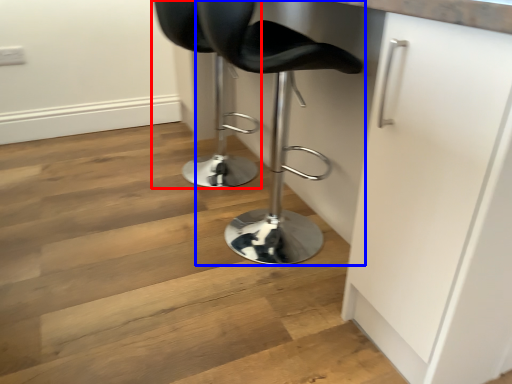
Question: Which object appears farthest to the camera in this image, chair (highlighted by a red box) or chair (highlighted by a blue box)?

Choices:
 (A) chair
 (B) chair

Answer: (A)